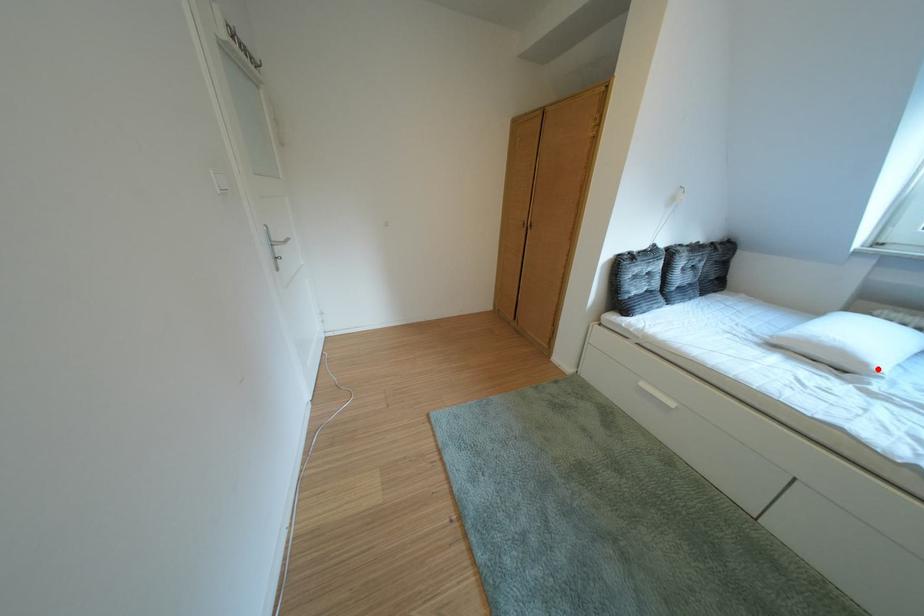
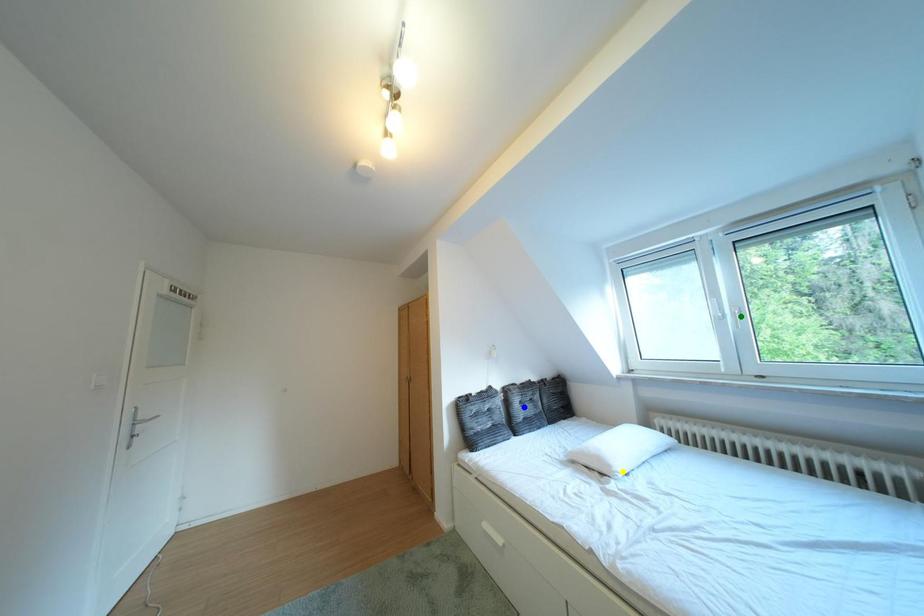
Question: I am providing you with two images of the same scene from different viewpoints. A red point is marked on the first image. You are given multiple points on the second image. Which point in image 2 is actually the same real-world point as the red point in image 1?

Choices:
 (A) yellow point
 (B) green point
 (C) blue point

Answer: (A)